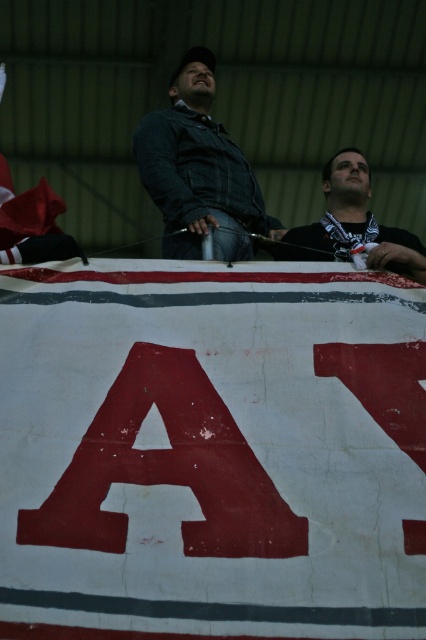
Is red fabric banner at center closer to the viewer compared to black matte shirt at center?

Yes, red fabric banner at center is in front of black matte shirt at center.

Which is in front, point (238, 308) or point (291, 234)?

Point (238, 308) is more forward.

What do you see at coordinates (210, 451) in the screenshot? The width and height of the screenshot is (426, 640). I see `red fabric banner at center` at bounding box center [210, 451].

The width and height of the screenshot is (426, 640). What are the coordinates of `red fabric banner at center` in the screenshot? It's located at (210, 451).

Who is shorter, red fabric banner at center or dark blue denim jacket at center?

With less height is red fabric banner at center.

What are the coordinates of `red fabric banner at center` in the screenshot? It's located at (210, 451).

Is point (161, 176) closer to camera compared to point (319, 227)?

Yes, point (161, 176) is closer to viewer.

Which is above, dark blue denim jacket at center or black matte shirt at center?

dark blue denim jacket at center is above.

Between point (204, 182) and point (331, 182), which one is positioned in front?

Point (204, 182) is more forward.

Locate an element on the screen. This screenshot has height=640, width=426. dark blue denim jacket at center is located at coordinates (195, 164).